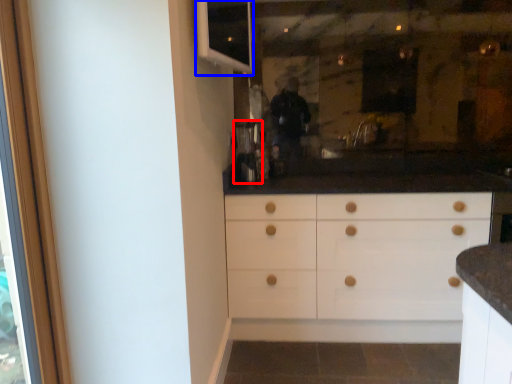
Question: Which object is closer to the camera taking this photo, coffee machine (highlighted by a red box) or window (highlighted by a blue box)?

Choices:
 (A) coffee machine
 (B) window

Answer: (B)